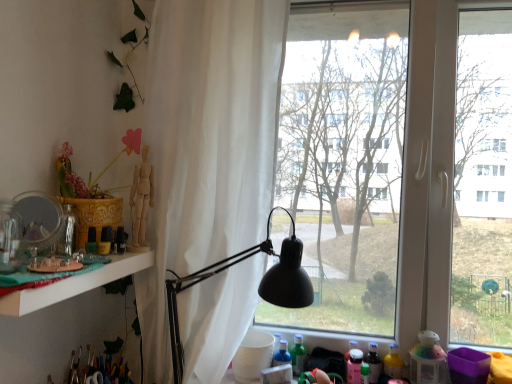
The height and width of the screenshot is (384, 512). I want to click on free space in front of wooden mannequin at left, so click(x=100, y=257).